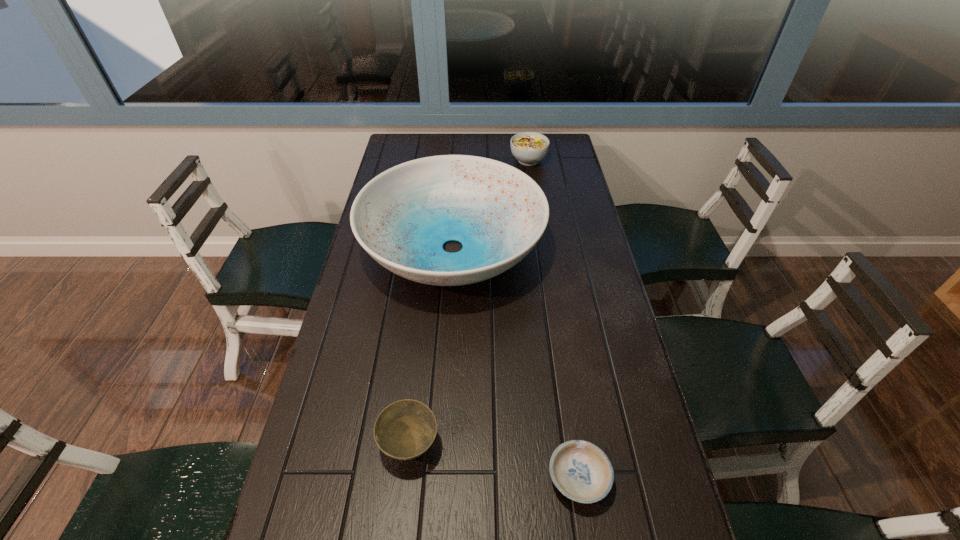
Where is `free spot that satisfies the following two spatial constraints: 1. on the back side of the tallest object; 2. on the left side of the left bowl`? Image resolution: width=960 pixels, height=540 pixels. free spot that satisfies the following two spatial constraints: 1. on the back side of the tallest object; 2. on the left side of the left bowl is located at coordinates tap(432, 248).

Locate an element on the screen. The height and width of the screenshot is (540, 960). free space that satisfies the following two spatial constraints: 1. on the back side of the soup bowl; 2. on the right side of the taller bowl is located at coordinates (443, 160).

Locate an element on the screen. Image resolution: width=960 pixels, height=540 pixels. free region that satisfies the following two spatial constraints: 1. on the back side of the farthest object; 2. on the right side of the left bowl is located at coordinates (443, 160).